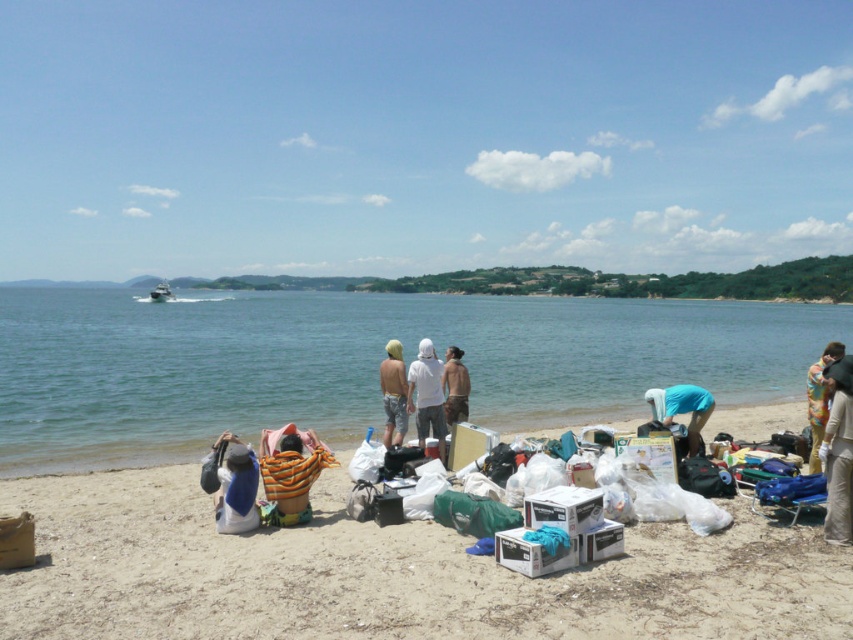
Question: Can you confirm if brown fabric bag at lower right is thinner than smooth tan skin at center?

Choices:
 (A) yes
 (B) no

Answer: (B)

Question: Which of these objects is positioned farthest from the camouflage shorts at center?

Choices:
 (A) brown fabric bag at lower right
 (B) blue fabric bag at lower right

Answer: (A)

Question: Based on their relative distances, which object is farther from the camouflage shorts at center?

Choices:
 (A) smooth tan skin at center
 (B) multicolored fabric bag at lower right
 (C) white plastic boat at center-left
 (D) beige sandy beach at lower center

Answer: (C)

Question: Can you confirm if clear blue water at center is positioned below white matte shirt at center?

Choices:
 (A) yes
 (B) no

Answer: (B)

Question: Among these points, which one is nearest to the camera?

Choices:
 (A) 401,403
 (B) 519,342
 (C) 460,387
 (D) 692,413

Answer: (A)

Question: Considering the relative positions of blue fabric bag at lower left and camouflage shorts at center in the image provided, where is blue fabric bag at lower left located with respect to camouflage shorts at center?

Choices:
 (A) below
 (B) above

Answer: (A)